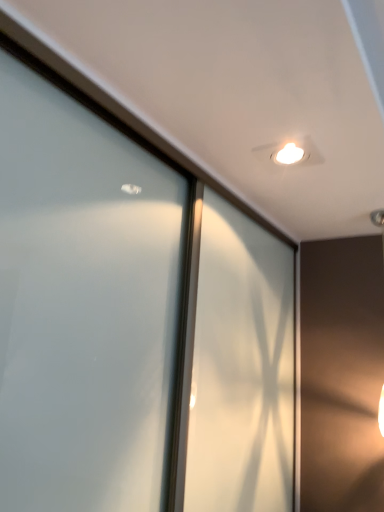
Identify the location of frosted glass window at upper center. (84, 303).

Image resolution: width=384 pixels, height=512 pixels. What do you see at coordinates (84, 303) in the screenshot? I see `frosted glass window at upper center` at bounding box center [84, 303].

This screenshot has width=384, height=512. Find the location of `frosted glass window at upper center`. frosted glass window at upper center is located at coordinates (84, 303).